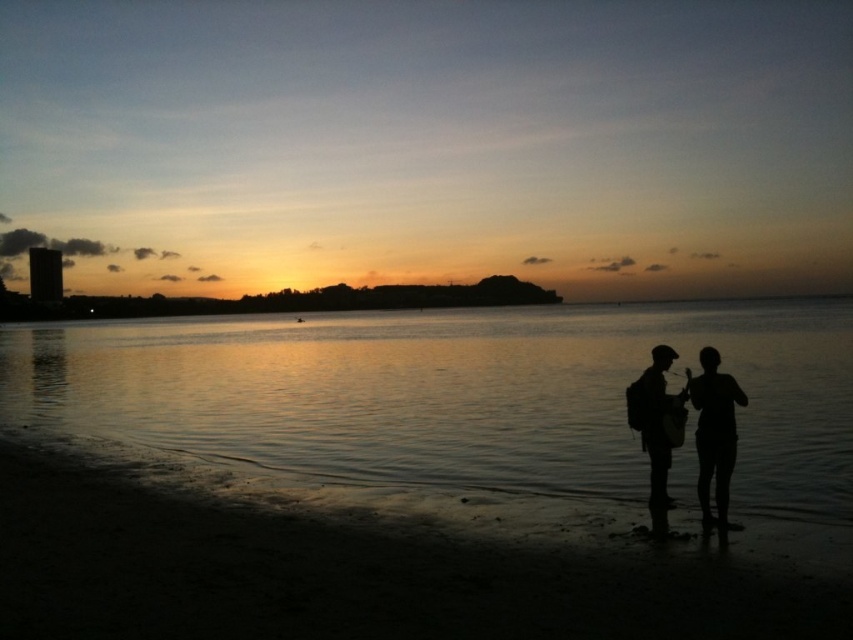
Between glistening water at center and dark sand at lower left, which one is positioned lower?

dark sand at lower left is below.

Which is more to the left, glistening water at center or dark sand at lower left?

dark sand at lower left is more to the left.

Describe the element at coordinates (451, 394) in the screenshot. I see `glistening water at center` at that location.

Where is `glistening water at center`? The image size is (853, 640). glistening water at center is located at coordinates (451, 394).

Who is positioned more to the left, glistening water at center or silhouette backpack at lower right?

silhouette backpack at lower right

Who is more forward, (404, 355) or (641, 428)?

Point (641, 428) is in front.

I want to click on glistening water at center, so click(x=451, y=394).

Is glistening water at center behind silhouette figure at lower right?

Yes, glistening water at center is behind silhouette figure at lower right.

Is glistening water at center positioned in front of silhouette figure at lower right?

No.

Is point (38, 324) in front of point (729, 465)?

No, (38, 324) is behind (729, 465).

Where is `glistening water at center`? The width and height of the screenshot is (853, 640). glistening water at center is located at coordinates (451, 394).